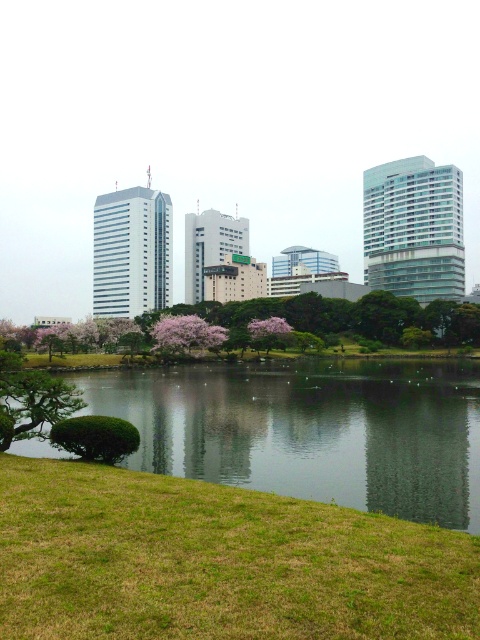
Is green grassy at lower left closer to the viewer compared to green grassy bank at lower left?

That is True.

Is green grassy at lower left above green grassy bank at lower left?

Yes.

Image resolution: width=480 pixels, height=640 pixels. Identify the location of green grassy at lower left. (216, 563).

What do you see at coordinates (216, 563) in the screenshot? The height and width of the screenshot is (640, 480). I see `green grassy at lower left` at bounding box center [216, 563].

Between point (430, 563) and point (252, 339), which one is positioned in front?

Positioned in front is point (430, 563).

The width and height of the screenshot is (480, 640). What do you see at coordinates (216, 563) in the screenshot?
I see `green grassy at lower left` at bounding box center [216, 563].

I want to click on green grassy at lower left, so click(x=216, y=563).

Does green grassy bank at lower left have a smaller size compared to pink blossoming tree at center?

Actually, green grassy bank at lower left might be larger than pink blossoming tree at center.

Who is positioned more to the left, green grassy bank at lower left or pink blossoming tree at center?

From the viewer's perspective, pink blossoming tree at center appears more on the left side.

Who is more distant from viewer, (288, 372) or (160, 323)?

The point (160, 323) is more distant.

The width and height of the screenshot is (480, 640). I want to click on green grassy bank at lower left, so click(x=312, y=429).